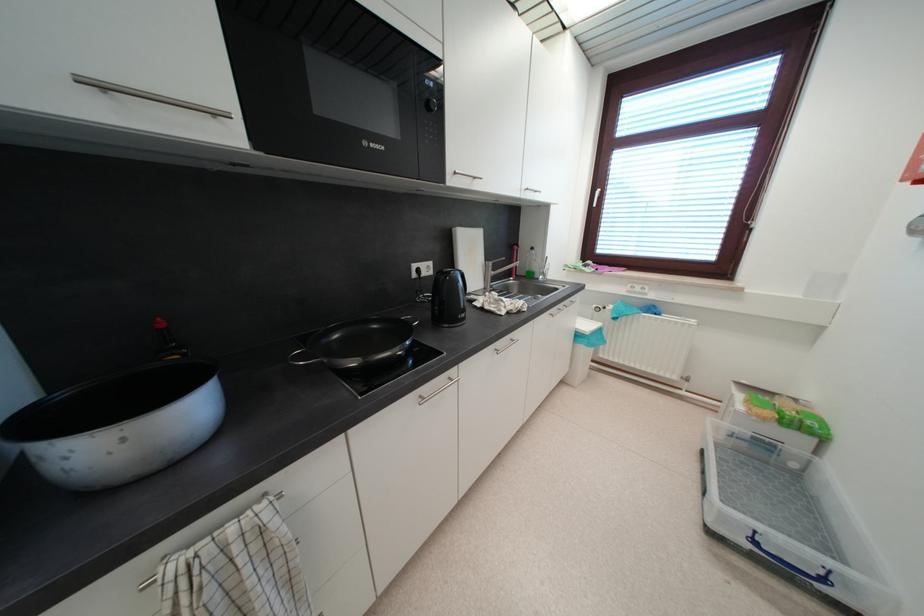
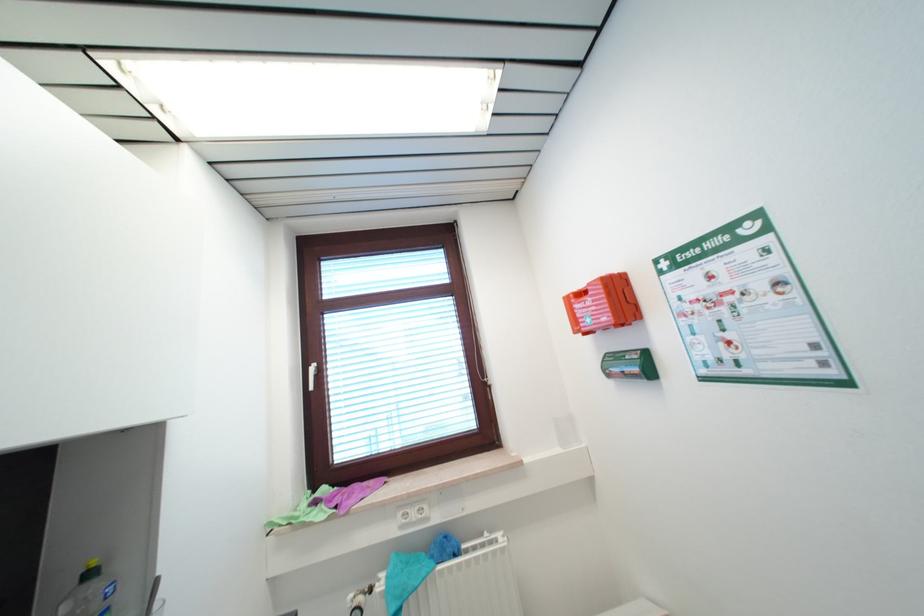
The point at (585, 265) is marked in the first image. Where is the corresponding point in the second image?

(311, 501)